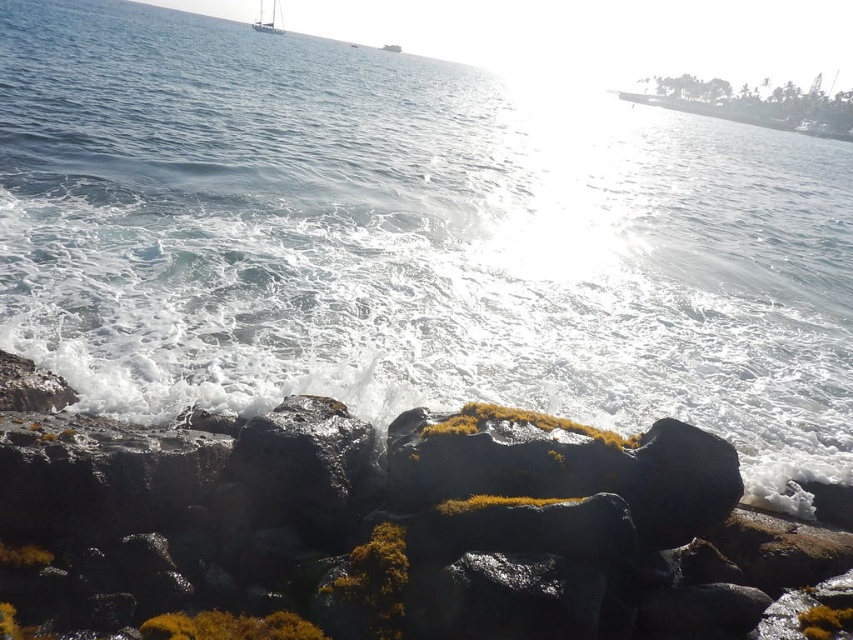
Can you confirm if rough volcanic rock at lower center is thinner than white glossy sailboat at upper center?

Indeed, rough volcanic rock at lower center has a lesser width compared to white glossy sailboat at upper center.

From the picture: Between rough volcanic rock at lower center and white glossy sailboat at upper center, which one appears on the right side from the viewer's perspective?

rough volcanic rock at lower center

Is point (306, 396) closer to camera compared to point (277, 8)?

Yes, it is in front of point (277, 8).

Where is `rough volcanic rock at lower center`? Image resolution: width=853 pixels, height=640 pixels. rough volcanic rock at lower center is located at coordinates (x=383, y=524).